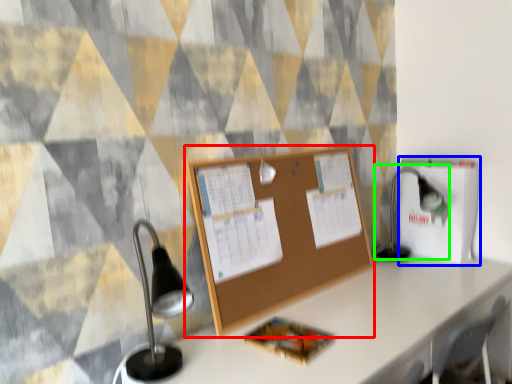
Question: Based on their relative distances, which object is farther from bulletin board (highlighted by a red box)? Choose from cardboard box (highlighted by a blue box) and table lamp (highlighted by a green box).

Choices:
 (A) cardboard box
 (B) table lamp

Answer: (B)